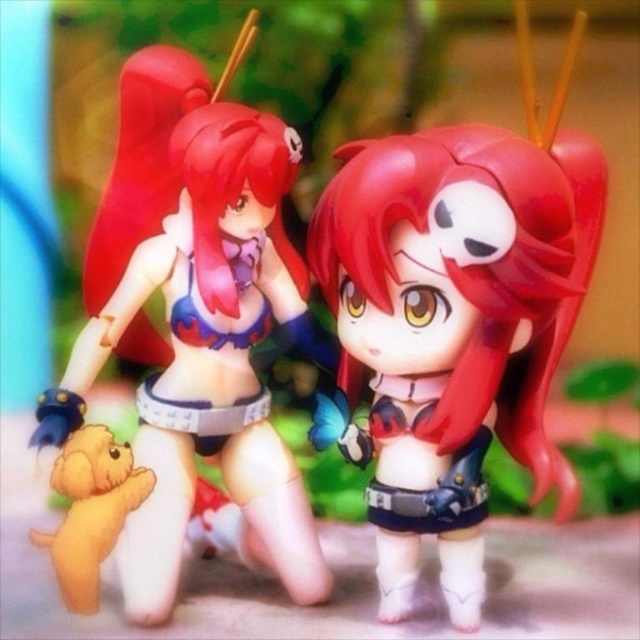
Based on the photo, who is lower down, satin red hair at center or matte plastic toy at center?

Positioned lower is matte plastic toy at center.

Does satin red hair at center appear over matte plastic toy at center?

Yes.

Does point (557, 237) come behind point (134, 525)?

No, it is in front of (134, 525).

Find the location of `satin red hair at center`. satin red hair at center is located at coordinates (454, 321).

Is satin red hair at center shorter than soft yellow plush dog at lower left?

No, satin red hair at center is not shorter than soft yellow plush dog at lower left.

Is satin red hair at center positioned before soft yellow plush dog at lower left?

That is True.

Is point (433, 310) closer to viewer compared to point (120, 470)?

No.

Where is `satin red hair at center`? The width and height of the screenshot is (640, 640). satin red hair at center is located at coordinates (454, 321).

Which is behind, point (273, 442) or point (93, 468)?

Positioned behind is point (273, 442).

Which is more to the left, matte plastic toy at center or soft yellow plush dog at lower left?

From the viewer's perspective, soft yellow plush dog at lower left appears more on the left side.

Who is more distant from viewer, (307, 355) or (112, 492)?

Point (307, 355)

Locate an element on the screen. Image resolution: width=640 pixels, height=640 pixels. matte plastic toy at center is located at coordinates (193, 332).